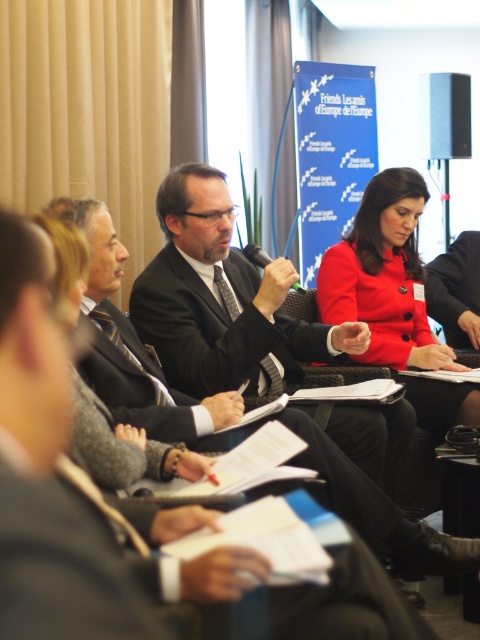
Can you confirm if dark gray suit at center is positioned above matte black suit at center?

No.

Can you confirm if dark gray suit at center is positioned to the left of matte black suit at center?

Correct, you'll find dark gray suit at center to the left of matte black suit at center.

The width and height of the screenshot is (480, 640). Describe the element at coordinates (217, 326) in the screenshot. I see `dark gray suit at center` at that location.

Where is `dark gray suit at center`? The height and width of the screenshot is (640, 480). dark gray suit at center is located at coordinates (217, 326).

In the scene shown: Is black fabric business suit at center above dark gray suit at center?

Incorrect, black fabric business suit at center is not positioned above dark gray suit at center.

Does black fabric business suit at center have a lesser width compared to dark gray suit at center?

Yes, black fabric business suit at center is thinner than dark gray suit at center.

What are the coordinates of `black fabric business suit at center` in the screenshot? It's located at (61, 570).

Locate an element on the screen. The width and height of the screenshot is (480, 640). black fabric business suit at center is located at coordinates (61, 570).

Which of these two, black fabric business suit at center or matte red coat at center, stands shorter?

Standing shorter between the two is black fabric business suit at center.

Is black fabric business suit at center thinner than matte red coat at center?

Incorrect, black fabric business suit at center's width is not less than matte red coat at center's.

Is point (321, 600) closer to viewer compared to point (465, 397)?

Yes, it is.

The image size is (480, 640). What are the coordinates of `black fabric business suit at center` in the screenshot? It's located at (61, 570).